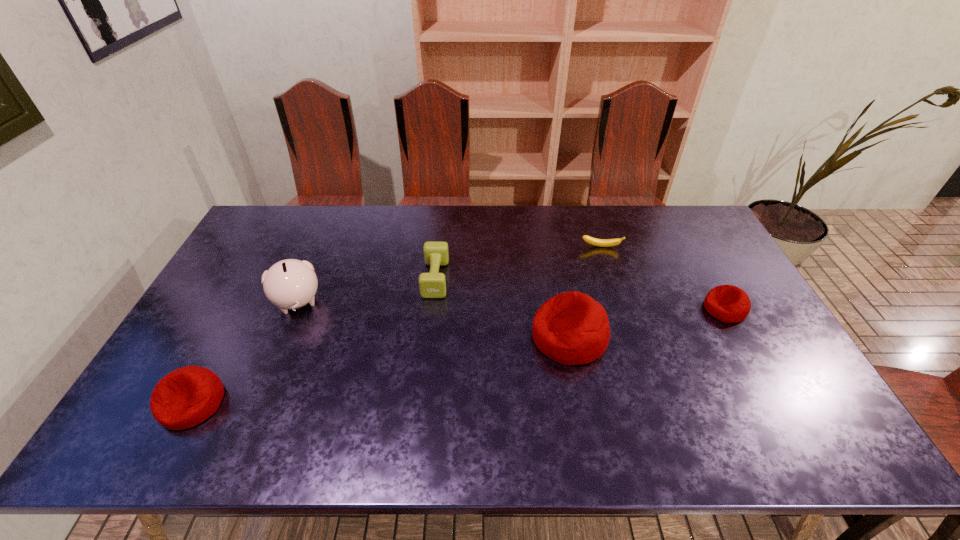
At what (x,y) coordinates should I click in order to perform the action: click on the leftmost beanbag. Please return your answer as a coordinate pair (x, y). Looking at the image, I should click on 185,397.

Locate an element on the screen. the leftmost object is located at coordinates (185, 397).

You are a GUI agent. You are given a task and a screenshot of the screen. Output one action in this format:
    pyautogui.click(x=<x>, y=<y>)
    Task: Click on the second beanbag from left to right
    The image size is (960, 540).
    Given the screenshot: What is the action you would take?
    pyautogui.click(x=571, y=328)

Locate an element on the screen. This screenshot has width=960, height=540. the tallest beanbag is located at coordinates (571, 328).

Find the location of `the rightmost beanbag`. the rightmost beanbag is located at coordinates (728, 303).

Where is `the rightmost object`? The width and height of the screenshot is (960, 540). the rightmost object is located at coordinates (728, 303).

You are a GUI agent. You are given a task and a screenshot of the screen. Output one action in this format:
    pyautogui.click(x=<x>, y=<y>)
    Task: Click on the second object from left to right
    
    Given the screenshot: What is the action you would take?
    pyautogui.click(x=288, y=284)

You are a GUI agent. You are given a task and a screenshot of the screen. Output one action in this format:
    pyautogui.click(x=<x>, y=<y>)
    Task: Click on the fourth object from right to left
    
    Given the screenshot: What is the action you would take?
    pyautogui.click(x=433, y=284)

Image resolution: width=960 pixels, height=540 pixels. I want to click on the farthest object, so click(593, 241).

The width and height of the screenshot is (960, 540). In order to click on the shortest object in this screenshot , I will do `click(593, 241)`.